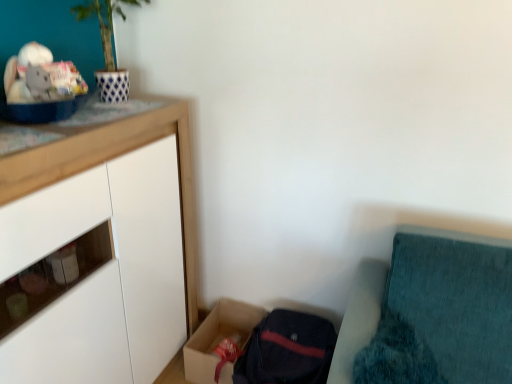
Question: Considering the relative sizes of white matte cabinet at upper left and teal fabric cushion at lower right in the image provided, is white matte cabinet at upper left taller than teal fabric cushion at lower right?

Choices:
 (A) no
 (B) yes

Answer: (B)

Question: Is teal fabric cushion at lower right surrounded by white matte cabinet at upper left?

Choices:
 (A) yes
 (B) no

Answer: (B)

Question: Is white matte cabinet at upper left turned away from teal fabric cushion at lower right?

Choices:
 (A) yes
 (B) no

Answer: (B)

Question: Can you confirm if white matte cabinet at upper left is shorter than teal fabric cushion at lower right?

Choices:
 (A) yes
 (B) no

Answer: (B)

Question: Is white matte cabinet at upper left behind teal fabric cushion at lower right?

Choices:
 (A) no
 (B) yes

Answer: (B)

Question: Visually, is teal fabric cushion at lower right positioned to the left or to the right of white matte cabinet at upper left?

Choices:
 (A) right
 (B) left

Answer: (A)

Question: Considering the positions of teal fabric cushion at lower right and white matte cabinet at upper left in the image, is teal fabric cushion at lower right bigger or smaller than white matte cabinet at upper left?

Choices:
 (A) small
 (B) big

Answer: (A)

Question: Is teal fabric cushion at lower right inside or outside of white matte cabinet at upper left?

Choices:
 (A) inside
 (B) outside

Answer: (B)

Question: Is point (376, 299) closer or farther from the camera than point (45, 205)?

Choices:
 (A) closer
 (B) farther

Answer: (B)

Question: Based on their sizes in the image, would you say cardboard box at lower center is bigger or smaller than white matte cabinet at upper left?

Choices:
 (A) big
 (B) small

Answer: (B)

Question: Choose the correct answer: Is cardboard box at lower center inside white matte cabinet at upper left or outside it?

Choices:
 (A) outside
 (B) inside

Answer: (A)

Question: Based on their positions, is cardboard box at lower center located to the left or right of white matte cabinet at upper left?

Choices:
 (A) left
 (B) right

Answer: (B)

Question: Considering the positions of cardboard box at lower center and white matte cabinet at upper left in the image, is cardboard box at lower center wider or thinner than white matte cabinet at upper left?

Choices:
 (A) thin
 (B) wide

Answer: (A)

Question: Is white matte cabinet at upper left wider or thinner than cardboard box at lower center?

Choices:
 (A) wide
 (B) thin

Answer: (A)

Question: From a real-world perspective, is white matte cabinet at upper left above or below cardboard box at lower center?

Choices:
 (A) above
 (B) below

Answer: (A)